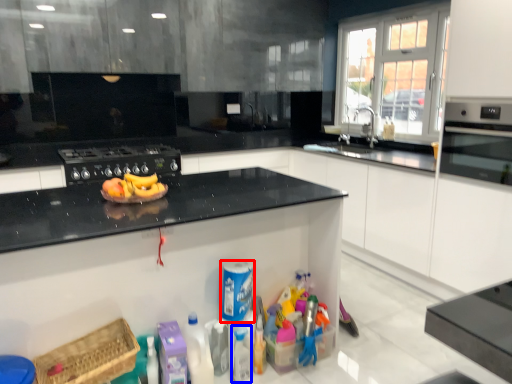
Question: Which object appears farthest to the camera in this image, cleaning product (highlighted by a red box) or bottle (highlighted by a blue box)?

Choices:
 (A) cleaning product
 (B) bottle

Answer: (B)